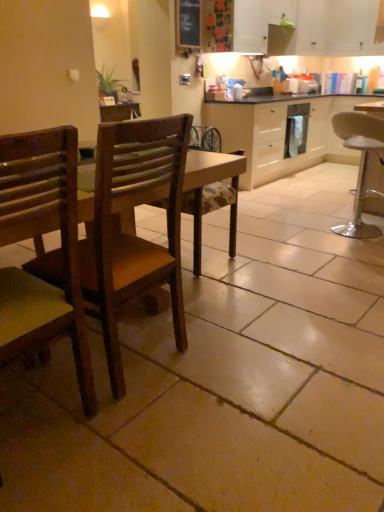
Question: Can white matte cabinet at upper right, the 1th cabinetry from the top, be found inside chalkboard at upper center?

Choices:
 (A) yes
 (B) no

Answer: (B)

Question: From a real-world perspective, is chalkboard at upper center under white matte cabinet at upper right, acting as the third cabinetry starting from the bottom?

Choices:
 (A) no
 (B) yes

Answer: (B)

Question: Is chalkboard at upper center not near white matte cabinet at upper right, acting as the third cabinetry starting from the bottom?

Choices:
 (A) yes
 (B) no

Answer: (A)

Question: Is chalkboard at upper center closer to camera compared to white matte cabinet at upper right, acting as the third cabinetry starting from the bottom?

Choices:
 (A) no
 (B) yes

Answer: (B)

Question: Considering the relative positions of chalkboard at upper center and white matte cabinet at upper right, acting as the third cabinetry starting from the bottom, in the image provided, is chalkboard at upper center behind white matte cabinet at upper right, acting as the third cabinetry starting from the bottom,?

Choices:
 (A) no
 (B) yes

Answer: (A)

Question: Would you say chalkboard at upper center is outside white matte cabinet at upper right, acting as the third cabinetry starting from the bottom?

Choices:
 (A) yes
 (B) no

Answer: (A)

Question: From a real-world perspective, is white glossy dishwasher at center beneath chalkboard at upper center?

Choices:
 (A) no
 (B) yes

Answer: (B)

Question: Is white glossy dishwasher at center at the left side of chalkboard at upper center?

Choices:
 (A) yes
 (B) no

Answer: (B)

Question: Is white glossy dishwasher at center smaller than chalkboard at upper center?

Choices:
 (A) no
 (B) yes

Answer: (B)

Question: Is white glossy dishwasher at center further to the viewer compared to chalkboard at upper center?

Choices:
 (A) no
 (B) yes

Answer: (B)

Question: From the image's perspective, does white glossy dishwasher at center appear higher than chalkboard at upper center?

Choices:
 (A) yes
 (B) no

Answer: (B)

Question: Does white glossy dishwasher at center contain chalkboard at upper center?

Choices:
 (A) no
 (B) yes

Answer: (A)

Question: From the image's perspective, does white glossy dishwasher at center appear higher than wooden chair at left, positioned as the 1th chair in left-to-right order?

Choices:
 (A) no
 (B) yes

Answer: (B)